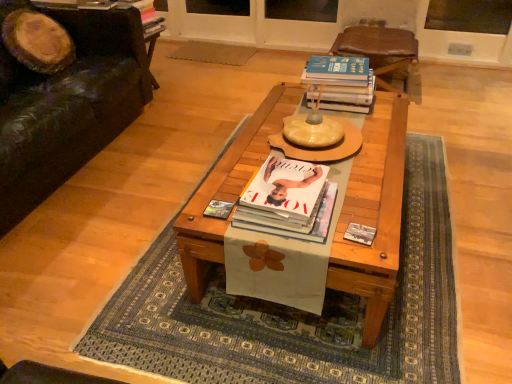
Where is `vacant space behind gray matte paperback book at center`? The height and width of the screenshot is (384, 512). vacant space behind gray matte paperback book at center is located at coordinates (358, 210).